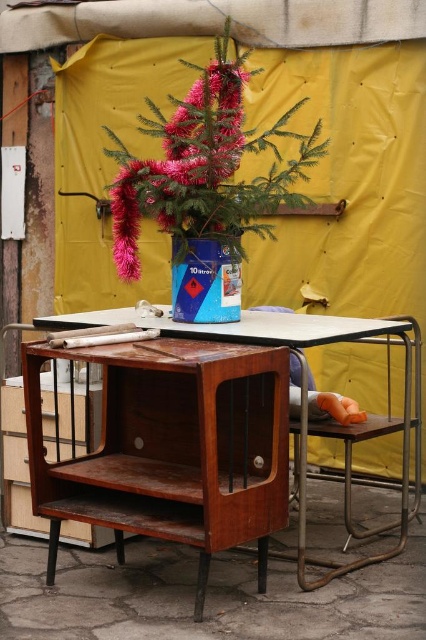
You are standing in front of the wooden table at center and want to place a gift under the shiny pink artificial tree at center. Can you walk directly to the tree without moving the table?

The shiny pink artificial tree at center is further to the viewer than wooden table at center, so you can walk directly to the tree without moving the table because it is positioned closer to you than the table.